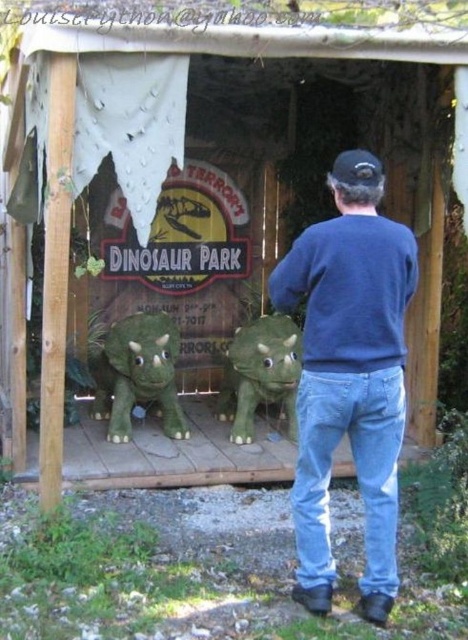
Is green plush dinosaur at center smaller than green matte dinosaur at center?

Actually, green plush dinosaur at center might be larger than green matte dinosaur at center.

Based on the photo, does green plush dinosaur at center appear on the right side of green matte dinosaur at center?

No, green plush dinosaur at center is not to the right of green matte dinosaur at center.

Who is more forward, (117, 384) or (242, 355)?

Positioned in front is point (242, 355).

Image resolution: width=468 pixels, height=640 pixels. I want to click on green plush dinosaur at center, so click(x=138, y=374).

In the scene shown: Does blue cotton sweater at center appear over green plush dinosaur at center?

Yes, blue cotton sweater at center is above green plush dinosaur at center.

The image size is (468, 640). I want to click on blue cotton sweater at center, so click(x=350, y=376).

You are a GUI agent. You are given a task and a screenshot of the screen. Output one action in this format:
    pyautogui.click(x=<x>, y=<y>)
    Task: Click on the blue cotton sweater at center
    
    Given the screenshot: What is the action you would take?
    pyautogui.click(x=350, y=376)

Is blue cotton sweater at center wider than green matte dinosaur at center?

Indeed, blue cotton sweater at center has a greater width compared to green matte dinosaur at center.

Between point (359, 164) and point (265, 317), which one is positioned behind?

The point (265, 317) is behind.

Locate an element on the screen. This screenshot has width=468, height=640. blue cotton sweater at center is located at coordinates (350, 376).